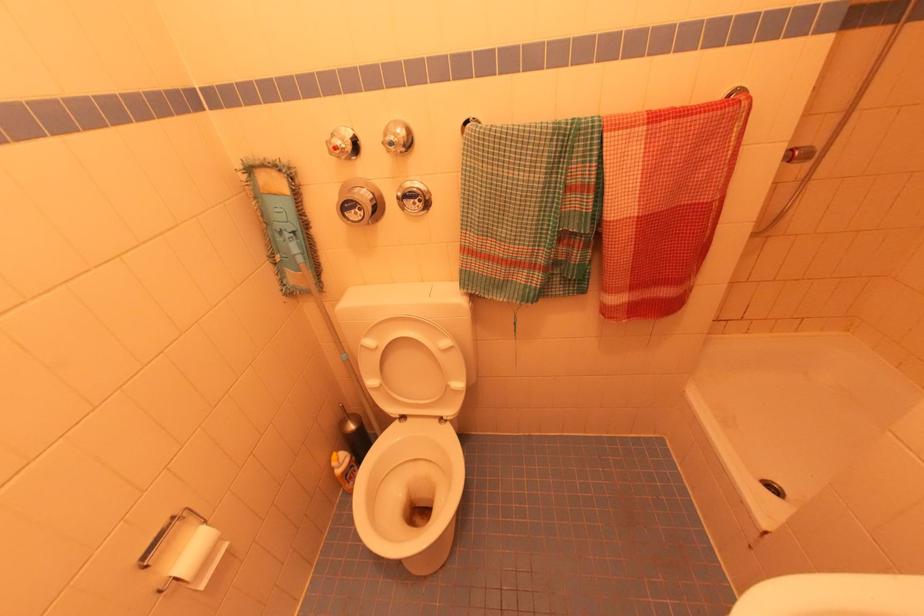
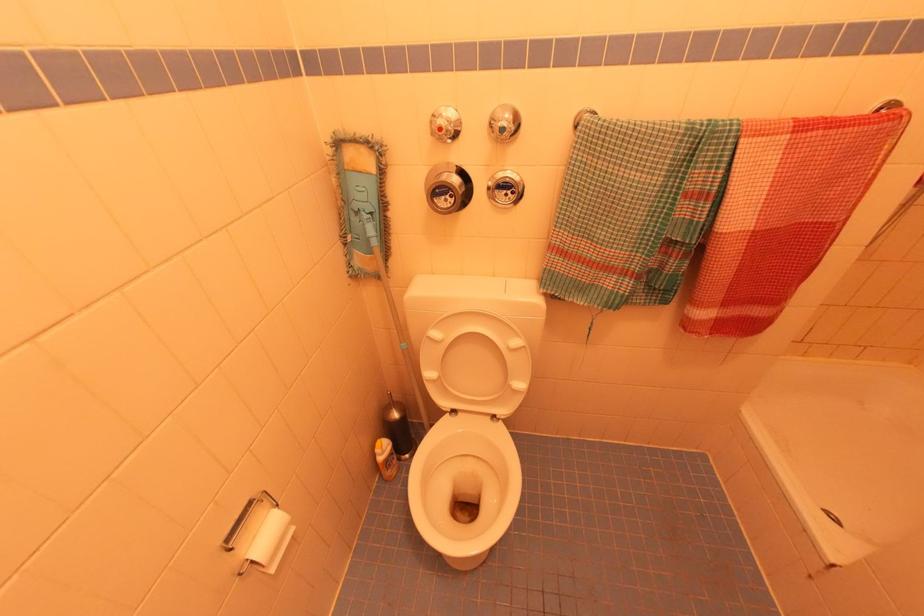
The point at (345, 142) is marked in the first image. Where is the corresponding point in the second image?

(450, 123)